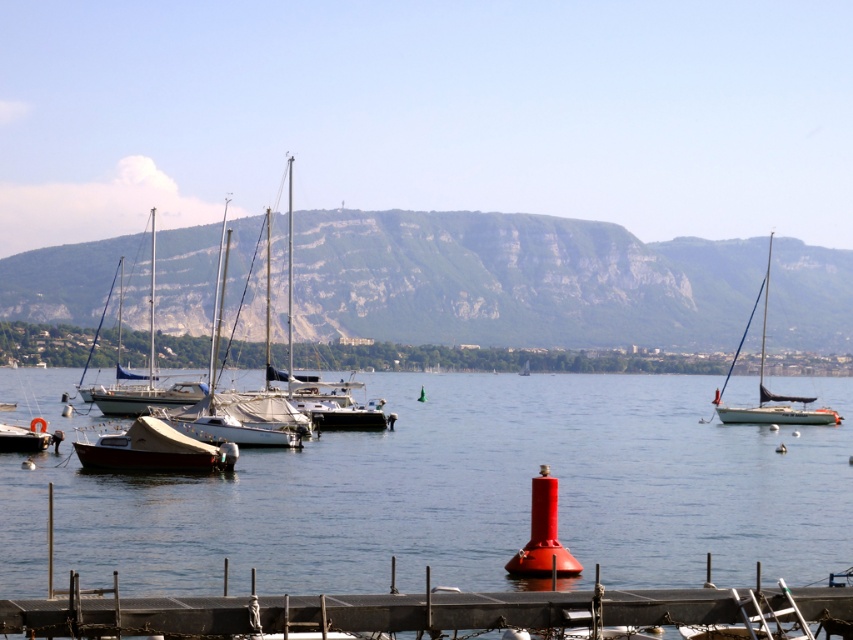
The height and width of the screenshot is (640, 853). Describe the element at coordinates (155, 449) in the screenshot. I see `wooden sailboat at lower left` at that location.

Is point (161, 445) positioned before point (769, 413)?

Yes, point (161, 445) is in front of point (769, 413).

Describe the element at coordinates (155, 449) in the screenshot. I see `wooden sailboat at lower left` at that location.

Find the location of a particular element. Image resolution: width=853 pixels, height=640 pixels. wooden sailboat at lower left is located at coordinates (155, 449).

Which is more to the left, smooth wood dock at lower center or matte black boat at lower left?

From the viewer's perspective, matte black boat at lower left appears more on the left side.

Identify the location of smooth wood dock at lower center. (437, 612).

Measure the distance from matte black boat at lower left to white matte sailboat at center.

658.30 feet

Looking at this image, which is more to the left, matte black boat at lower left or white matte sailboat at center?

Positioned to the left is matte black boat at lower left.

Is point (3, 429) closer to camera compared to point (525, 365)?

Yes, it is in front of point (525, 365).

I want to click on matte black boat at lower left, so click(24, 436).